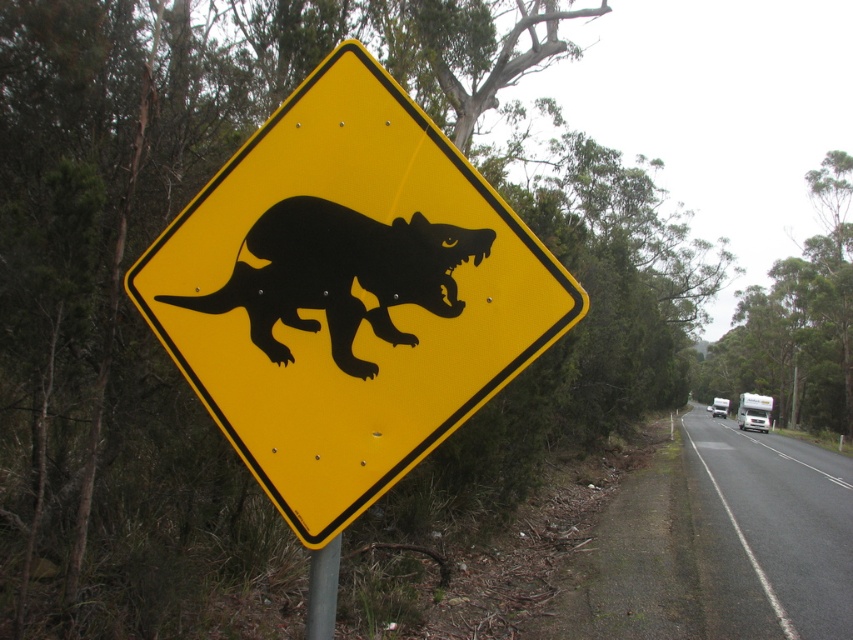
Who is positioned more to the left, yellow metal sign at center or metallic gray pole at lower center?

From the viewer's perspective, metallic gray pole at lower center appears more on the left side.

Is point (363, 499) more distant than point (312, 602)?

No, (363, 499) is in front of (312, 602).

This screenshot has height=640, width=853. Describe the element at coordinates (347, 292) in the screenshot. I see `yellow metal sign at center` at that location.

You are a GUI agent. You are given a task and a screenshot of the screen. Output one action in this format:
    pyautogui.click(x=<x>, y=<y>)
    Task: Click on the yellow metal sign at center
    The image size is (853, 640).
    Given the screenshot: What is the action you would take?
    pyautogui.click(x=347, y=292)

Is yellow metal sign at center above black glossy ferret at center?

Actually, yellow metal sign at center is below black glossy ferret at center.

Which is above, yellow metal sign at center or black glossy ferret at center?

black glossy ferret at center is above.

Find the location of a particular element. The height and width of the screenshot is (640, 853). yellow metal sign at center is located at coordinates (347, 292).

In order to click on yellow metal sign at center in this screenshot , I will do `click(347, 292)`.

Which is more to the left, black glossy ferret at center or metallic gray pole at lower center?

black glossy ferret at center is more to the left.

Between black glossy ferret at center and metallic gray pole at lower center, which one is positioned higher?

black glossy ferret at center is higher up.

Is point (358, 310) less distant than point (329, 592)?

Yes, it is.

The width and height of the screenshot is (853, 640). Find the location of `black glossy ferret at center`. black glossy ferret at center is located at coordinates pyautogui.click(x=340, y=275).